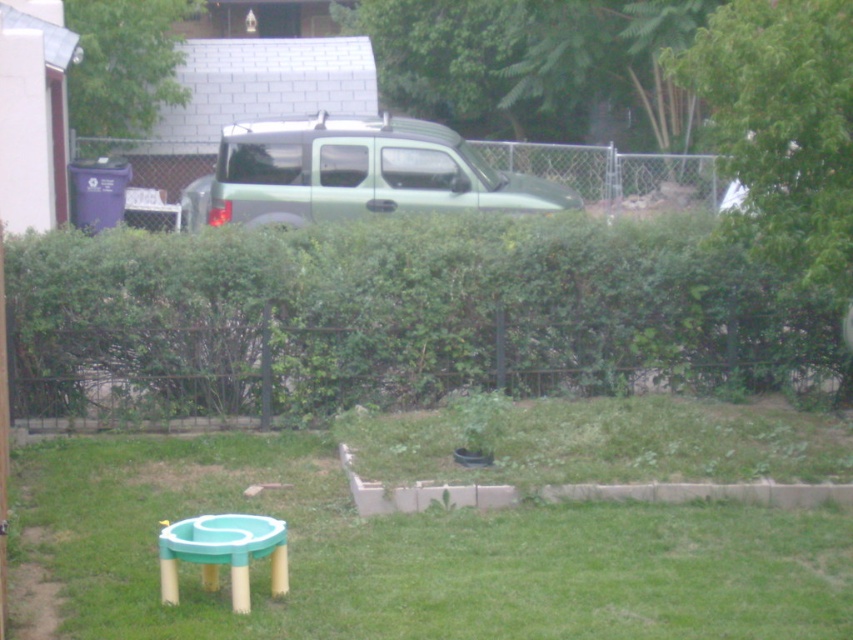
Does point (311, 449) lie behind point (125, 42)?

No.

The width and height of the screenshot is (853, 640). I want to click on green grass at lower center, so click(415, 554).

What do you see at coordinates (398, 310) in the screenshot? Image resolution: width=853 pixels, height=640 pixels. I see `green leafy hedge at center` at bounding box center [398, 310].

Between point (776, 355) and point (231, 582), which one is positioned in front?

Point (231, 582)

Is point (15, 353) positioned behind point (236, 577)?

Yes, it is.

Identify the location of green leafy hedge at center. (398, 310).

Consider the image. Does green grass at lower center have a smaller size compared to teal plastic stool at lower left?

No.

Is green grass at lower center thinner than teal plastic stool at lower left?

In fact, green grass at lower center might be wider than teal plastic stool at lower left.

Who is more forward, (329, 509) or (271, 589)?

Point (271, 589) is in front.

What are the coordinates of `green grass at lower center` in the screenshot? It's located at (415, 554).